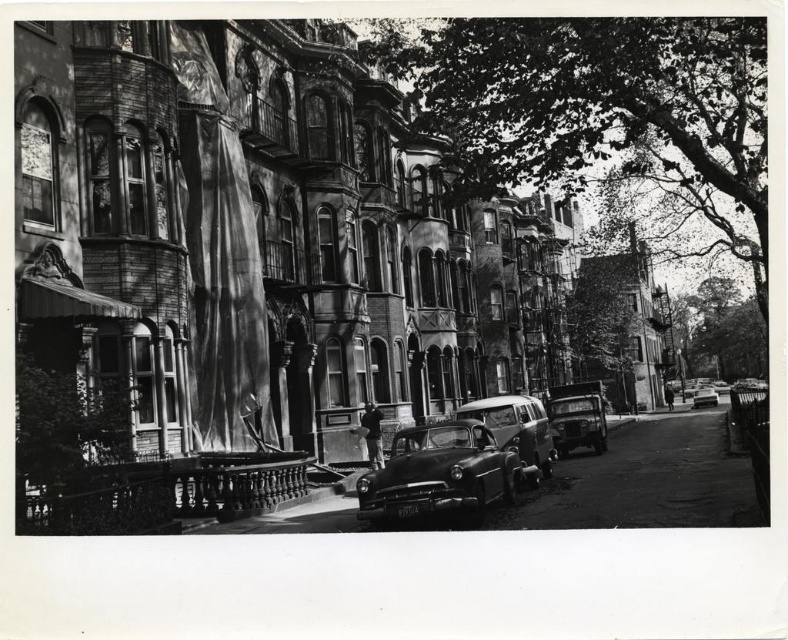
Where is `shiny chrome car at center-right`? This screenshot has width=788, height=640. shiny chrome car at center-right is located at coordinates click(578, 422).

Does point (588, 413) lie behind point (712, 388)?

No, (588, 413) is closer to viewer.

Is point (562, 403) less distant than point (699, 394)?

Yes, it is in front of point (699, 394).

This screenshot has height=640, width=788. Find the location of `shiny chrome car at center-right`. shiny chrome car at center-right is located at coordinates (578, 422).

Between point (502, 401) and point (556, 442), which one is positioned behind?

Positioned behind is point (556, 442).

Image resolution: width=788 pixels, height=640 pixels. Find the location of `shiny silver station wagon at center`. shiny silver station wagon at center is located at coordinates (515, 426).

In the scene shown: Who is more distant from viewer, (526, 396) or (556, 435)?

Positioned behind is point (526, 396).

Locate an element on the screen. The image size is (788, 640). shiny silver station wagon at center is located at coordinates tap(515, 426).

Is shiny silver station wagon at center positioned before shiny silver sedan at center?

Yes, it is in front of shiny silver sedan at center.

Can you confirm if shiny silver station wagon at center is shorter than shiny silver sedan at center?

No, shiny silver station wagon at center is not shorter than shiny silver sedan at center.

The height and width of the screenshot is (640, 788). What are the coordinates of `shiny silver station wagon at center` in the screenshot? It's located at (515, 426).